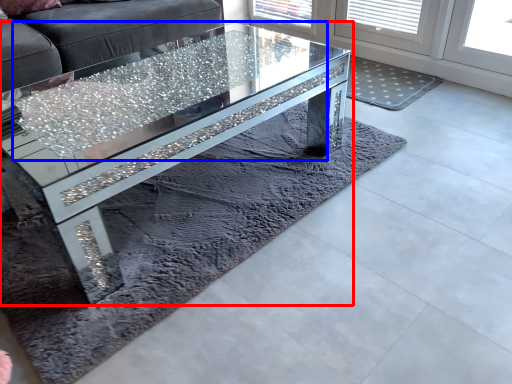
Question: Which object is further to the camera taking this photo, coffee table (highlighted by a red box) or glass table (highlighted by a blue box)?

Choices:
 (A) coffee table
 (B) glass table

Answer: (B)